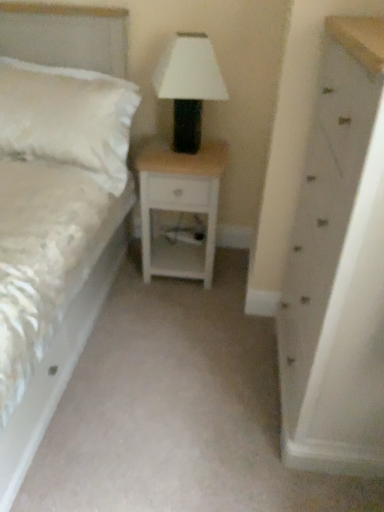
Find the location of a particular element. The height and width of the screenshot is (512, 384). white wood nightstand at center is located at coordinates (180, 207).

What is the approximate width of white wood nightstand at center?

38.14 centimeters.

Where is `white fluffy pillow at left`? This screenshot has height=512, width=384. white fluffy pillow at left is located at coordinates (68, 118).

This screenshot has height=512, width=384. Identify the location of white matte/black textured table lamp at center. (189, 86).

The width and height of the screenshot is (384, 512). Find the location of `white satin bed at left`. white satin bed at left is located at coordinates (57, 367).

Considering the relative positions of white painted wood chest of drawers at right and white wood nightstand at center in the image provided, is white painted wood chest of drawers at right in front of white wood nightstand at center?

Yes, white painted wood chest of drawers at right is closer to the viewer.

From a real-world perspective, is white painted wood chest of drawers at right located beneath white wood nightstand at center?

Actually, white painted wood chest of drawers at right is physically above white wood nightstand at center in the real world.

Which of these two, white painted wood chest of drawers at right or white wood nightstand at center, is bigger?

white painted wood chest of drawers at right is bigger.

At what (x,y) coordinates should I click in order to perform the action: click on nightstand that appears behind the white painted wood chest of drawers at right. Please return your answer as a coordinate pair (x, y). Looking at the image, I should click on (180, 207).

In terms of height, does white fluffy pillow at left look taller or shorter compared to white matte/black textured table lamp at center?

In the image, white fluffy pillow at left appears to be shorter than white matte/black textured table lamp at center.

Can you confirm if white fluffy pillow at left is positioned to the right of white matte/black textured table lamp at center?

No.

From a real-world perspective, between white fluffy pillow at left and white matte/black textured table lamp at center, who is vertically higher?

white matte/black textured table lamp at center, from a real-world perspective.

Image resolution: width=384 pixels, height=512 pixels. Identify the location of pillow on the left of white matte/black textured table lamp at center. pyautogui.click(x=68, y=118).

From a real-world perspective, relative to white painted wood chest of drawers at right, is white satin bed at left vertically above or below?

white satin bed at left is situated lower than white painted wood chest of drawers at right in the real world.

Is white painted wood chest of drawers at right a part of white satin bed at left?

Actually, white painted wood chest of drawers at right is outside white satin bed at left.

Is white satin bed at left bigger or smaller than white painted wood chest of drawers at right?

Clearly, white satin bed at left is larger in size than white painted wood chest of drawers at right.

Is white satin bed at left positioned before white painted wood chest of drawers at right?

Yes, white satin bed at left is in front of white painted wood chest of drawers at right.

Based on the photo, from the image's perspective, is white matte/black textured table lamp at center located beneath white fluffy pillow at left?

Yes, from the image's perspective, white matte/black textured table lamp at center is below white fluffy pillow at left.

Identify the location of pillow located behind the white matte/black textured table lamp at center. (68, 118).

Is white matte/black textured table lamp at center taller than white fluffy pillow at left?

Yes, white matte/black textured table lamp at center is taller than white fluffy pillow at left.

Measure the distance between white matte/black textured table lamp at center and white fluffy pillow at left.

white matte/black textured table lamp at center is 13.75 inches away from white fluffy pillow at left.

From the image's perspective, is white fluffy pillow at left under white satin bed at left?

No, from the image's perspective, white fluffy pillow at left is not beneath white satin bed at left.

Can you tell me how much white fluffy pillow at left and white satin bed at left differ in facing direction?

They differ by 0.00193 degrees in their facing directions.

In terms of width, does white fluffy pillow at left look wider or thinner when compared to white satin bed at left?

In the image, white fluffy pillow at left appears to be more narrow than white satin bed at left.

Between point (81, 136) and point (85, 331), which one is positioned in front?

The point (81, 136) is more forward.

Is white matte/black textured table lamp at center bigger or smaller than white wood nightstand at center?

white matte/black textured table lamp at center is smaller than white wood nightstand at center.

From a real-world perspective, is white matte/black textured table lamp at center above or below white wood nightstand at center?

Clearly, from a real-world perspective, white matte/black textured table lamp at center is above white wood nightstand at center.

Can we say white matte/black textured table lamp at center lies outside white wood nightstand at center?

That's correct, white matte/black textured table lamp at center is outside of white wood nightstand at center.

From a real-world perspective, is white wood nightstand at center located beneath white satin bed at left?

A: Yes.

Based on their sizes in the image, would you say white wood nightstand at center is bigger or smaller than white satin bed at left?

In the image, white wood nightstand at center appears to be smaller than white satin bed at left.

Is point (145, 173) closer to camera compared to point (126, 212)?

Yes, point (145, 173) is closer to viewer.

From the image's perspective, is white wood nightstand at center beneath white satin bed at left?

Incorrect, from the image's perspective, white wood nightstand at center is higher than white satin bed at left.

Find the location of a particular element. The image size is (384, 512). nightstand located behind the white painted wood chest of drawers at right is located at coordinates (180, 207).

Where is `pillow that is under the white matte/black textured table lamp at center (from a real-world perspective)`? Image resolution: width=384 pixels, height=512 pixels. pillow that is under the white matte/black textured table lamp at center (from a real-world perspective) is located at coordinates (68, 118).

Looking at the image, which one is located further to white fluffy pillow at left, white satin bed at left or white wood nightstand at center?

white satin bed at left is further to white fluffy pillow at left.

When comparing their distances from white matte/black textured table lamp at center, does white painted wood chest of drawers at right or white fluffy pillow at left seem closer?

white fluffy pillow at left.

Estimate the real-world distances between objects in this image. Which object is closer to white satin bed at left, white wood nightstand at center or white matte/black textured table lamp at center?

white wood nightstand at center is closer to white satin bed at left.

Consider the image. Based on their spatial positions, is white wood nightstand at center or white satin bed at left further from white matte/black textured table lamp at center?

white satin bed at left is positioned further to the anchor white matte/black textured table lamp at center.

Looking at the image, which one is located closer to white matte/black textured table lamp at center, white fluffy pillow at left or white wood nightstand at center?

white wood nightstand at center.

Looking at this image, based on their spatial positions, is white fluffy pillow at left or white matte/black textured table lamp at center closer to white painted wood chest of drawers at right?

white matte/black textured table lamp at center.

Considering their positions, is white matte/black textured table lamp at center positioned closer to white satin bed at left than white wood nightstand at center?

Among the two, white wood nightstand at center is located nearer to white satin bed at left.

Estimate the real-world distances between objects in this image. Which object is closer to white painted wood chest of drawers at right, white fluffy pillow at left or white wood nightstand at center?

white wood nightstand at center is closer to white painted wood chest of drawers at right.

The image size is (384, 512). In order to click on table lamp positioned between white satin bed at left and white fluffy pillow at left from near to far in this screenshot , I will do `click(189, 86)`.

You are a GUI agent. You are given a task and a screenshot of the screen. Output one action in this format:
    pyautogui.click(x=<x>, y=<y>)
    Task: Click on the table lamp between white satin bed at left and white painted wood chest of drawers at right from left to right
    
    Given the screenshot: What is the action you would take?
    pyautogui.click(x=189, y=86)

Where is `table lamp between white painted wood chest of drawers at right and white fluffy pillow at left from front to back`? Image resolution: width=384 pixels, height=512 pixels. table lamp between white painted wood chest of drawers at right and white fluffy pillow at left from front to back is located at coordinates (189, 86).

What are the coordinates of `nightstand between white fluffy pillow at left and white matte/black textured table lamp at center from left to right` in the screenshot? It's located at pyautogui.click(x=180, y=207).